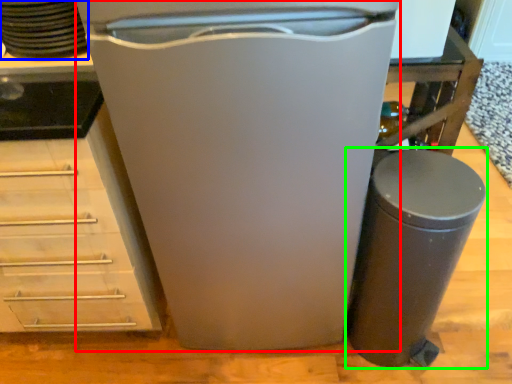
Question: Considering the real-world distances, which object is closest to home appliance (highlighted by a red box)? appliance (highlighted by a blue box) or waste container (highlighted by a green box).

Choices:
 (A) appliance
 (B) waste container

Answer: (B)